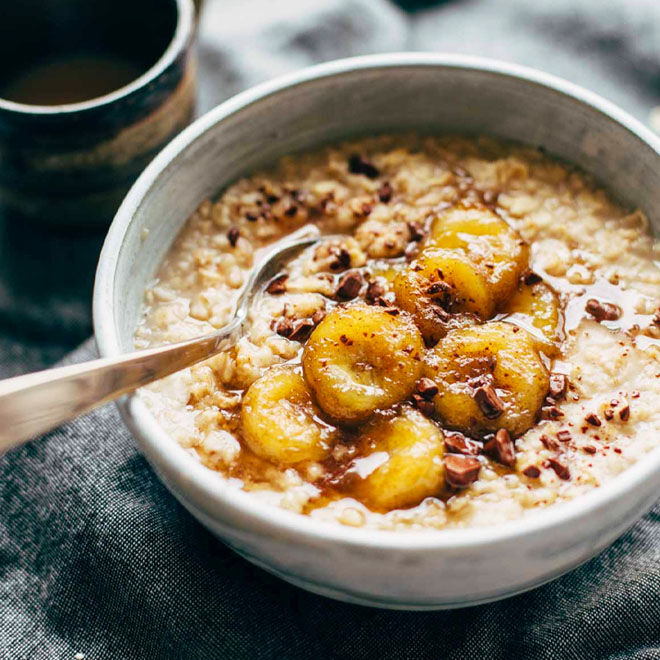
This screenshot has width=660, height=660. Identify the location of bowl. (510, 535).